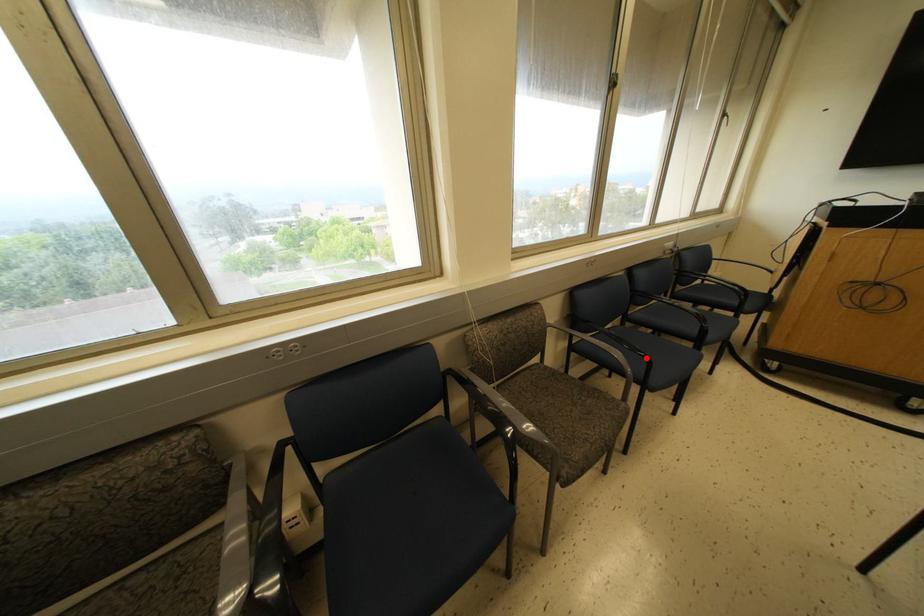
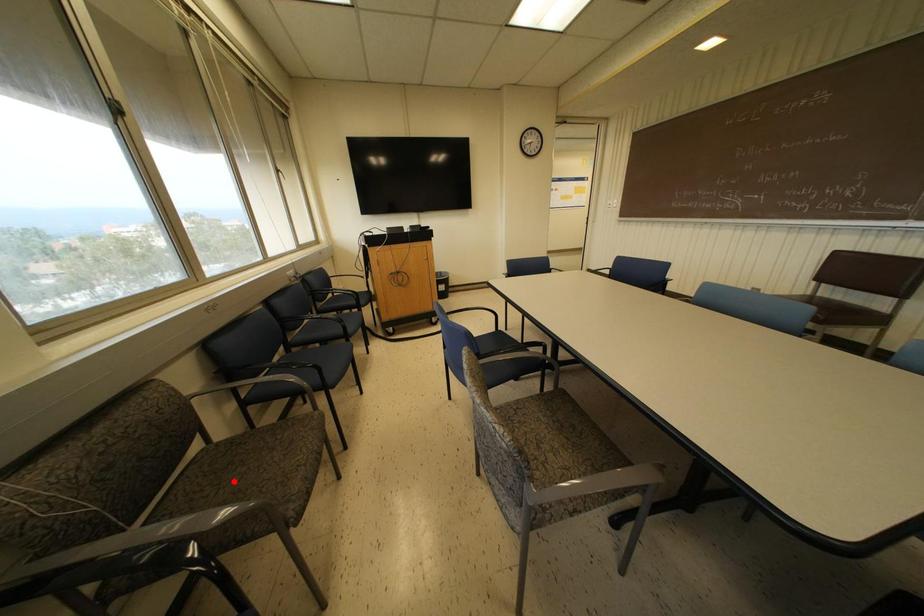
I am providing you with two images of the same scene from different viewpoints. A red point is marked on the first image and another point is marked on the second image. Is the marked point in image1 the same physical position as the marked point in image2?

No